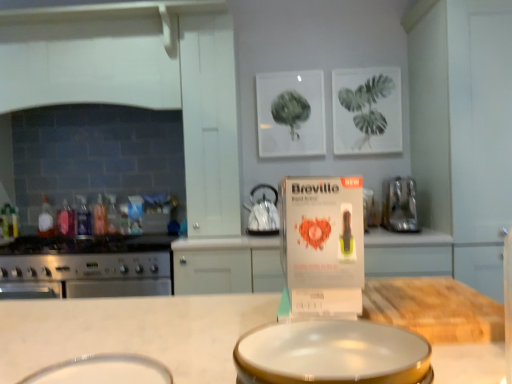
Question: Considering the relative positions of translucent plastic bottle at stove left, the 3th bottle in the right-to-left sequence, and satin black kettle at center, positioned as the second kitchen appliance in right-to-left order, in the image provided, is translucent plastic bottle at stove left, the 3th bottle in the right-to-left sequence, in front of satin black kettle at center, positioned as the second kitchen appliance in right-to-left order,?

Choices:
 (A) yes
 (B) no

Answer: (B)

Question: From a real-world perspective, is translucent plastic bottle at stove left, the 3th bottle in the right-to-left sequence, on satin black kettle at center, which is counted as the 2th kitchen appliance, starting from the left?

Choices:
 (A) yes
 (B) no

Answer: (B)

Question: From a real-world perspective, is translucent plastic bottle at stove left, the 3th bottle in the right-to-left sequence, beneath satin black kettle at center, positioned as the second kitchen appliance in right-to-left order?

Choices:
 (A) yes
 (B) no

Answer: (A)

Question: Considering the relative sizes of translucent plastic bottle at stove left, the 3th bottle in the right-to-left sequence, and satin black kettle at center, which is counted as the 2th kitchen appliance, starting from the left, in the image provided, is translucent plastic bottle at stove left, the 3th bottle in the right-to-left sequence, smaller than satin black kettle at center, which is counted as the 2th kitchen appliance, starting from the left,?

Choices:
 (A) no
 (B) yes

Answer: (B)

Question: Would you say translucent plastic bottle at stove left, the 3th bottle in the right-to-left sequence, is a long distance from satin black kettle at center, which is counted as the 2th kitchen appliance, starting from the left?

Choices:
 (A) no
 (B) yes

Answer: (B)

Question: From a real-world perspective, relative to satin black kettle at center, which is counted as the 2th kitchen appliance, starting from the left, is translucent plastic bottle at stove left, arranged as the first bottle when viewed from the right, vertically above or below?

Choices:
 (A) above
 (B) below

Answer: (B)

Question: Considering the positions of translucent plastic bottle at stove left, the fifth bottle positioned from the left, and satin black kettle at center, which is counted as the 2th kitchen appliance, starting from the left, in the image, is translucent plastic bottle at stove left, the fifth bottle positioned from the left, wider or thinner than satin black kettle at center, which is counted as the 2th kitchen appliance, starting from the left,?

Choices:
 (A) wide
 (B) thin

Answer: (B)

Question: Considering the positions of point (114, 215) and point (269, 203), is point (114, 215) closer or farther from the camera than point (269, 203)?

Choices:
 (A) farther
 (B) closer

Answer: (A)

Question: Based on their sizes in the image, would you say translucent plastic bottle at stove left, the fifth bottle positioned from the left, is bigger or smaller than satin black kettle at center, which is counted as the 2th kitchen appliance, starting from the left?

Choices:
 (A) big
 (B) small

Answer: (B)

Question: Does point [72, 364] appear closer or farther from the camera than point [46, 220]?

Choices:
 (A) closer
 (B) farther

Answer: (A)

Question: In terms of width, does white glossy basin at lower center, which ranks as the first basin in left-to-right order, look wider or thinner when compared to translucent plastic bottle at left, placed as the first bottle when sorted from left to right?

Choices:
 (A) wide
 (B) thin

Answer: (A)

Question: Choose the correct answer: Is white glossy basin at lower center, which ranks as the first basin in left-to-right order, inside translucent plastic bottle at left, placed as the first bottle when sorted from left to right, or outside it?

Choices:
 (A) inside
 (B) outside

Answer: (B)

Question: From the image's perspective, is white glossy basin at lower center, which ranks as the 2th basin in right-to-left order, above or below translucent plastic bottle at left, which is the fifth bottle from right to left?

Choices:
 (A) above
 (B) below

Answer: (B)

Question: From a real-world perspective, relative to white glossy basin at center, marked as the first basin in a right-to-left arrangement, is translucent plastic bottle at left, which is the fifth bottle from right to left, vertically above or below?

Choices:
 (A) above
 (B) below

Answer: (A)

Question: Which is correct: translucent plastic bottle at left, placed as the first bottle when sorted from left to right, is inside white glossy basin at center, marked as the first basin in a right-to-left arrangement, or outside of it?

Choices:
 (A) outside
 (B) inside

Answer: (A)